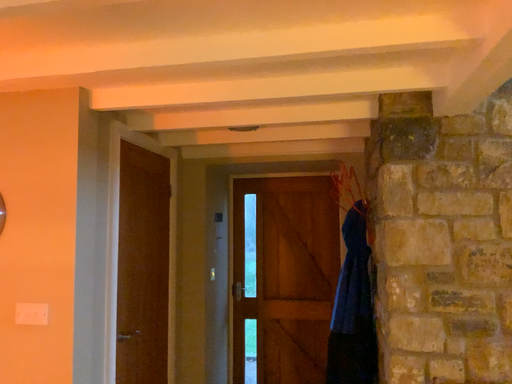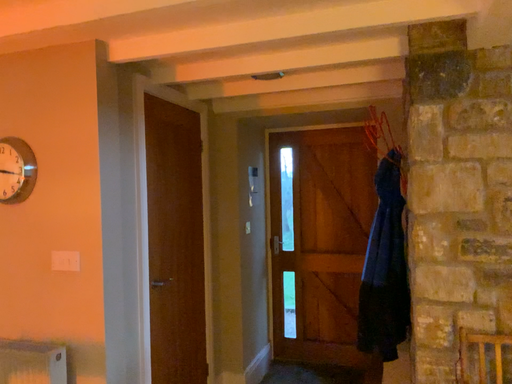
Question: Which way did the camera rotate in the video?

Choices:
 (A) rotated left
 (B) rotated right

Answer: (A)